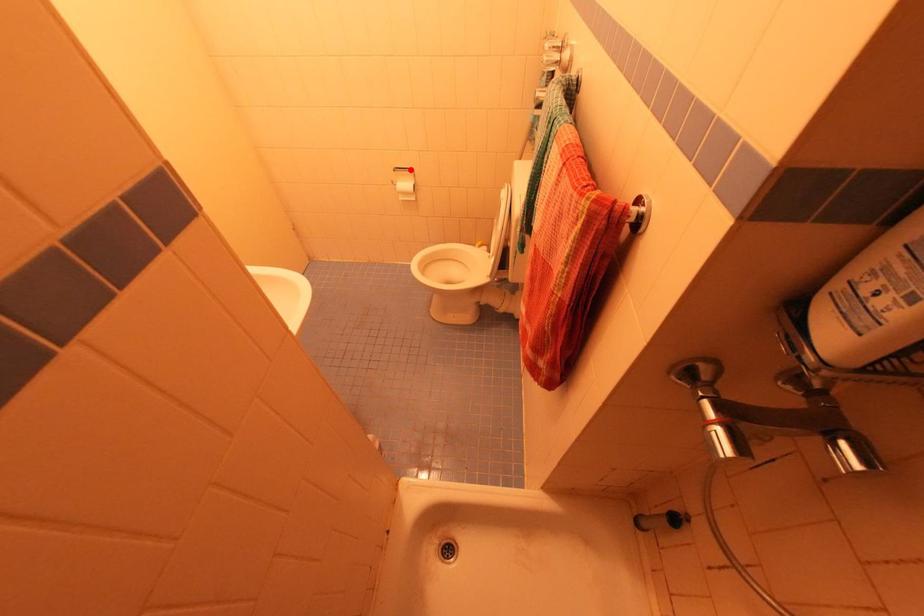
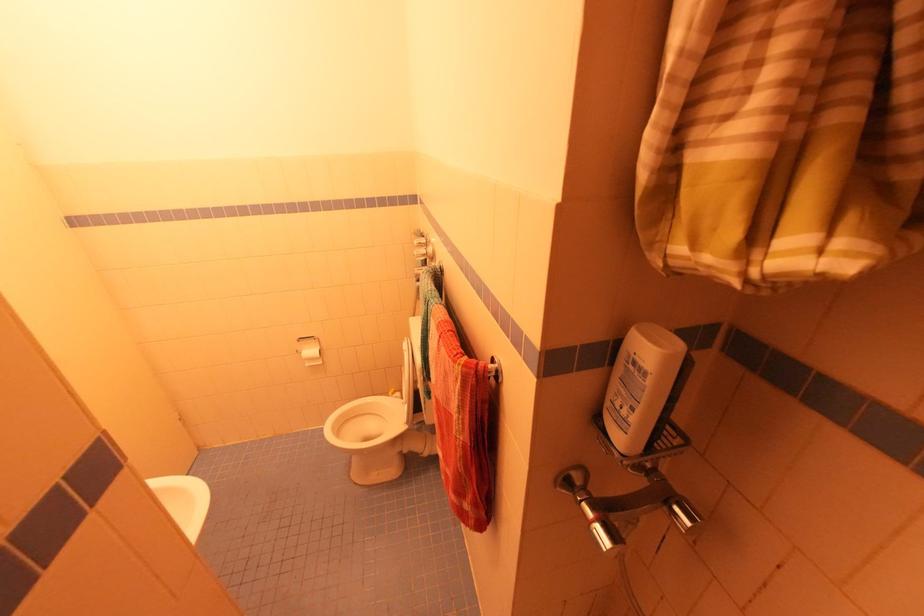
Question: I am providing you with two images of the same scene from different viewpoints. A red point is marked on the first image. Can you still see the location of the red point in image 2?

Choices:
 (A) Yes
 (B) No

Answer: (A)